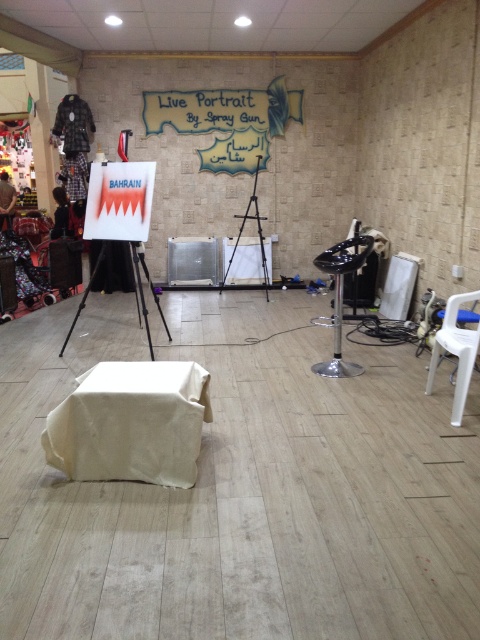
Question: Which is farther from the wooden tripod at center?

Choices:
 (A) white plastic chair at lower right
 (B) black glossy chair at center right

Answer: (A)

Question: Considering the relative positions of white matte tripod at center and wooden tripod at center in the image provided, where is white matte tripod at center located with respect to wooden tripod at center?

Choices:
 (A) left
 (B) right

Answer: (A)

Question: Which of the following is the closest to the observer?

Choices:
 (A) wooden tripod at center
 (B) white plastic chair at lower right
 (C) white matte tripod at center
 (D) black glossy chair at center right

Answer: (B)

Question: Does white plastic chair at lower right appear under black glossy chair at center right?

Choices:
 (A) yes
 (B) no

Answer: (A)

Question: Which of these objects is positioned closest to the wooden tripod at center?

Choices:
 (A) white matte tripod at center
 (B) black glossy chair at center right
 (C) white plastic chair at lower right

Answer: (A)

Question: Is white plastic chair at lower right in front of white matte tripod at center?

Choices:
 (A) yes
 (B) no

Answer: (A)